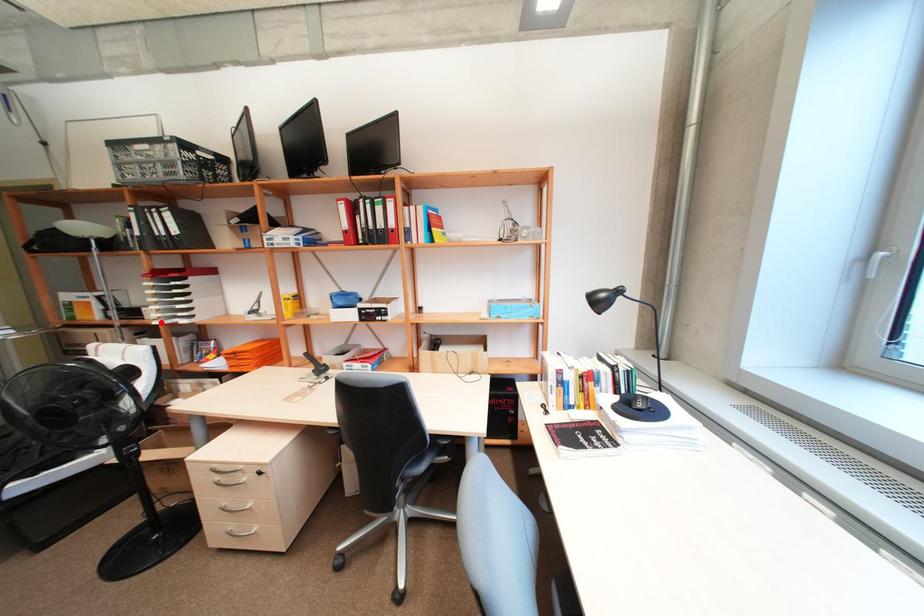
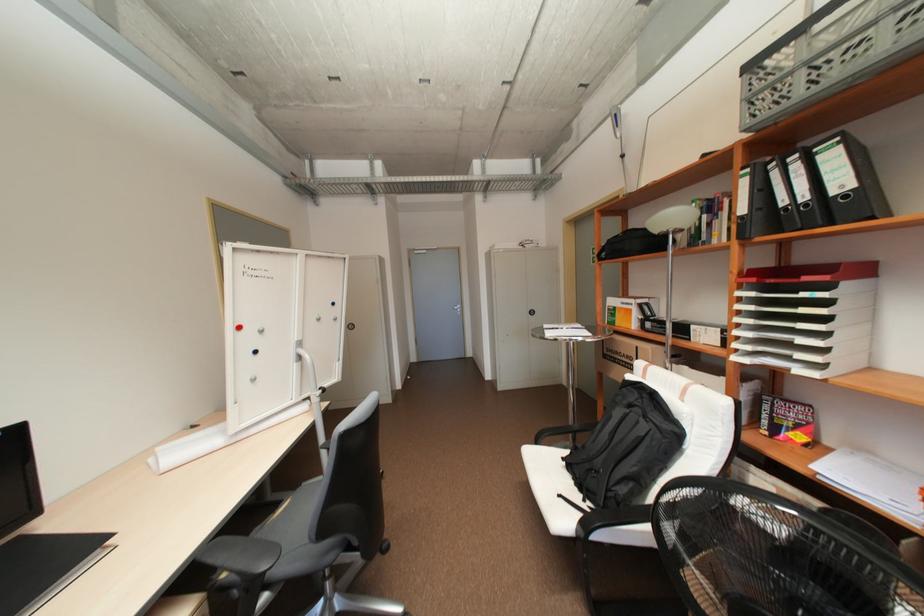
Where in the second image is the point corresponding to the highlighted location from the first image?

(742, 358)